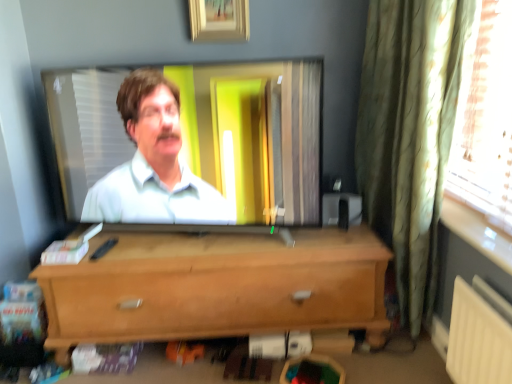
Where is `green textured curtain at right`? This screenshot has width=512, height=384. green textured curtain at right is located at coordinates (409, 134).

From the image's perspective, would you say green textured curtain at right is positioned over light brown wood chest of drawers at center?

Yes.

Considering the positions of points (377, 104) and (181, 339), is point (377, 104) closer to camera compared to point (181, 339)?

No.

Is green textured curtain at right directly adjacent to light brown wood chest of drawers at center?

green textured curtain at right and light brown wood chest of drawers at center are not in contact.

Considering the sizes of objects green textured curtain at right and light brown wood chest of drawers at center in the image provided, who is thinner, green textured curtain at right or light brown wood chest of drawers at center?

Thinner between the two is green textured curtain at right.

Is light brown wood chest of drawers at center aimed at wooden picture frame at upper center?

No, light brown wood chest of drawers at center does not turn towards wooden picture frame at upper center.

Does light brown wood chest of drawers at center come behind wooden picture frame at upper center?

No, light brown wood chest of drawers at center is closer to the camera.

In terms of width, does light brown wood chest of drawers at center look wider or thinner when compared to wooden picture frame at upper center?

light brown wood chest of drawers at center is wider than wooden picture frame at upper center.

Which of these two, wooden picture frame at upper center or light brown wood chest of drawers at center, stands shorter?

Standing shorter between the two is wooden picture frame at upper center.

How different are the orientations of wooden picture frame at upper center and light brown wood chest of drawers at center in degrees?

The facing directions of wooden picture frame at upper center and light brown wood chest of drawers at center are 1.02 degrees apart.

Is wooden picture frame at upper center at the right side of light brown wood chest of drawers at center?

Correct, you'll find wooden picture frame at upper center to the right of light brown wood chest of drawers at center.

Does point (199, 36) appear closer or farther from the camera than point (379, 189)?

Point (199, 36).

Does wooden picture frame at upper center have a smaller size compared to green textured curtain at right?

Correct, wooden picture frame at upper center occupies less space than green textured curtain at right.

From a real-world perspective, does wooden picture frame at upper center sit lower than green textured curtain at right?

Incorrect, from a real-world perspective, wooden picture frame at upper center is higher than green textured curtain at right.

Could you tell me if wooden picture frame at upper center is turned towards green textured curtain at right?

No, wooden picture frame at upper center is not turned towards green textured curtain at right.

From a real-world perspective, who is located higher, green textured curtain at right or wooden picture frame at upper center?

From a 3D spatial view, wooden picture frame at upper center is above.

Which is in front, green textured curtain at right or wooden picture frame at upper center?

Positioned in front is green textured curtain at right.

Does green textured curtain at right appear on the right side of wooden picture frame at upper center?

Yes.

Is green textured curtain at right aimed at wooden picture frame at upper center?

Yes, green textured curtain at right is aimed at wooden picture frame at upper center.

From the image's perspective, would you say light brown wood chest of drawers at center is positioned over green textured curtain at right?

No, from the image's perspective, light brown wood chest of drawers at center is not over green textured curtain at right.

Is light brown wood chest of drawers at center oriented towards green textured curtain at right?

No, light brown wood chest of drawers at center is not turned towards green textured curtain at right.

At what (x,y) coordinates should I click in order to perform the action: click on the chest of drawers that appears below the green textured curtain at right (from a real-world perspective). Please return your answer as a coordinate pair (x, y). Looking at the image, I should click on (216, 287).

Locate an element on the screen. chest of drawers below the green textured curtain at right (from a real-world perspective) is located at coordinates coord(216,287).

Where is `chest of drawers below the wooden picture frame at upper center (from the image's perspective)`? This screenshot has width=512, height=384. chest of drawers below the wooden picture frame at upper center (from the image's perspective) is located at coordinates (216, 287).

Estimate the real-world distances between objects in this image. Which object is closer to light brown wood chest of drawers at center, wooden picture frame at upper center or green textured curtain at right?

The object closer to light brown wood chest of drawers at center is green textured curtain at right.

Estimate the real-world distances between objects in this image. Which object is closer to light brown wood chest of drawers at center, green textured curtain at right or wooden picture frame at upper center?

The object closer to light brown wood chest of drawers at center is green textured curtain at right.

From the image, which object appears to be farther from wooden picture frame at upper center, light brown wood chest of drawers at center or green textured curtain at right?

light brown wood chest of drawers at center lies further to wooden picture frame at upper center than the other object.

When comparing their distances from green textured curtain at right, does light brown wood chest of drawers at center or wooden picture frame at upper center seem closer?

Among the two, light brown wood chest of drawers at center is located nearer to green textured curtain at right.

From the image, which object appears to be farther from green textured curtain at right, wooden picture frame at upper center or light brown wood chest of drawers at center?

wooden picture frame at upper center.

Estimate the real-world distances between objects in this image. Which object is closer to wooden picture frame at upper center, green textured curtain at right or light brown wood chest of drawers at center?

green textured curtain at right lies closer to wooden picture frame at upper center than the other object.

Locate an element on the screen. curtain between wooden picture frame at upper center and light brown wood chest of drawers at center from top to bottom is located at coordinates (409, 134).